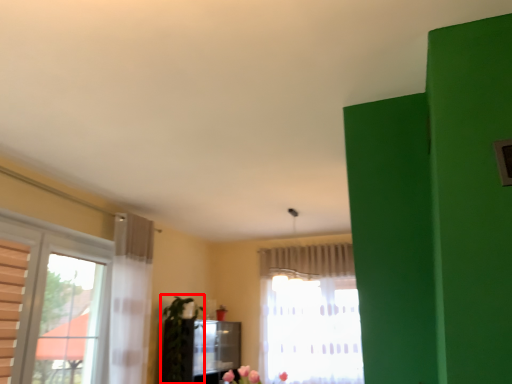
Question: Considering the relative positions of plant (annotated by the red box) and curtain in the image provided, where is plant (annotated by the red box) located with respect to the staircase?

Choices:
 (A) right
 (B) left

Answer: (B)